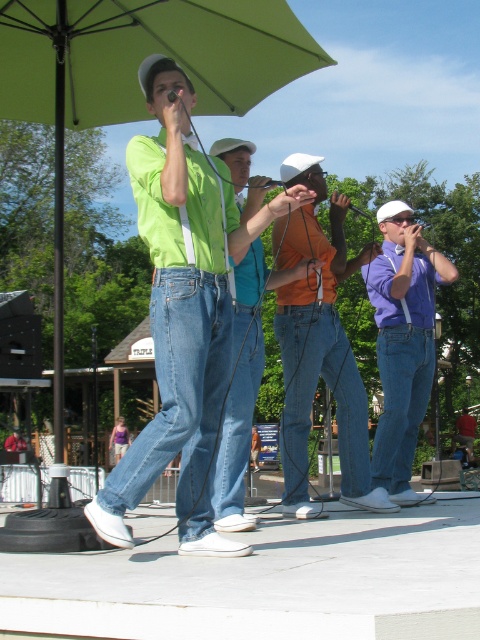
Question: Which object is closer to the camera taking this photo?

Choices:
 (A) green fabric umbrella at upper center
 (B) matte green shirt at center
 (C) purple matte shirt at center

Answer: (B)

Question: Is orange matte shirt at center to the left of denim jeans at center from the viewer's perspective?

Choices:
 (A) yes
 (B) no

Answer: (B)

Question: Is green fabric umbrella at upper center to the left of orange matte shirt at center from the viewer's perspective?

Choices:
 (A) yes
 (B) no

Answer: (A)

Question: Which of the following is the farthest from the observer?

Choices:
 (A) (149, 33)
 (B) (121, 541)

Answer: (A)

Question: Can you confirm if matte green shirt at center is positioned above purple matte shirt at center?

Choices:
 (A) no
 (B) yes

Answer: (B)

Question: Which is farther from the matte green shirt at center?

Choices:
 (A) denim jeans at center
 (B) purple matte shirt at center
 (C) green fabric umbrella at upper center
 (D) orange matte shirt at center

Answer: (A)